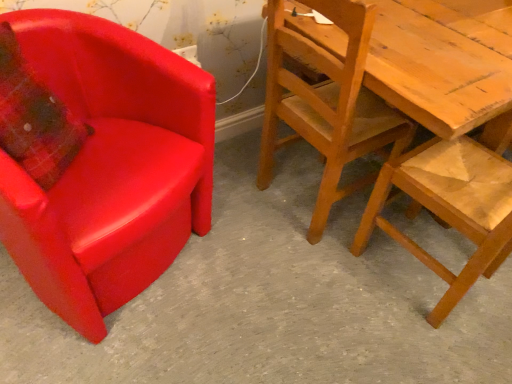
Identify the location of free point to the right of matte red armchair at left, the third chair when ordered from right to left. The height and width of the screenshot is (384, 512). (257, 282).